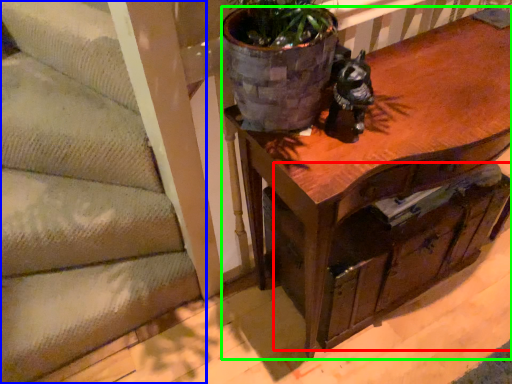
Question: Which object is the closest to the drawer (highlighted by a red box)? Choose among these: stairwell (highlighted by a blue box) or table (highlighted by a green box).

Choices:
 (A) stairwell
 (B) table

Answer: (B)